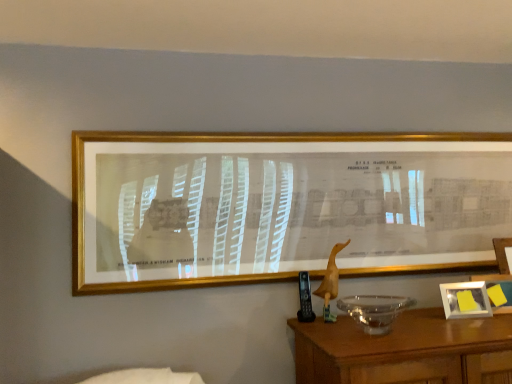
Identify the location of free point above gold metallic picture frame at upper center, the 1th picture frame from the front (from a real-world perspective). Image resolution: width=512 pixels, height=384 pixels. (326, 125).